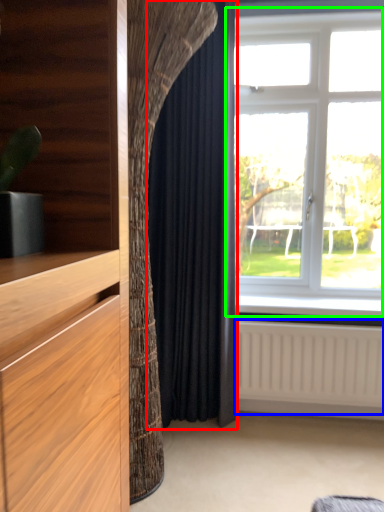
Question: Which object is the closest to the curtain (highlighted by a red box)? Choose among these: radiator (highlighted by a blue box) or window (highlighted by a green box).

Choices:
 (A) radiator
 (B) window

Answer: (A)